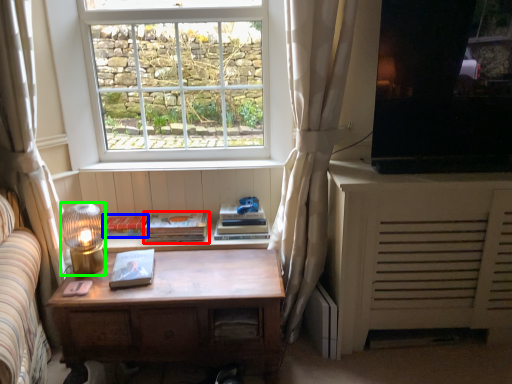
Question: Estimate the real-world distances between objects in this image. Which object is farther from paperback book (highlighted by a red box), paperback book (highlighted by a blue box) or lamp (highlighted by a green box)?

Choices:
 (A) paperback book
 (B) lamp

Answer: (B)